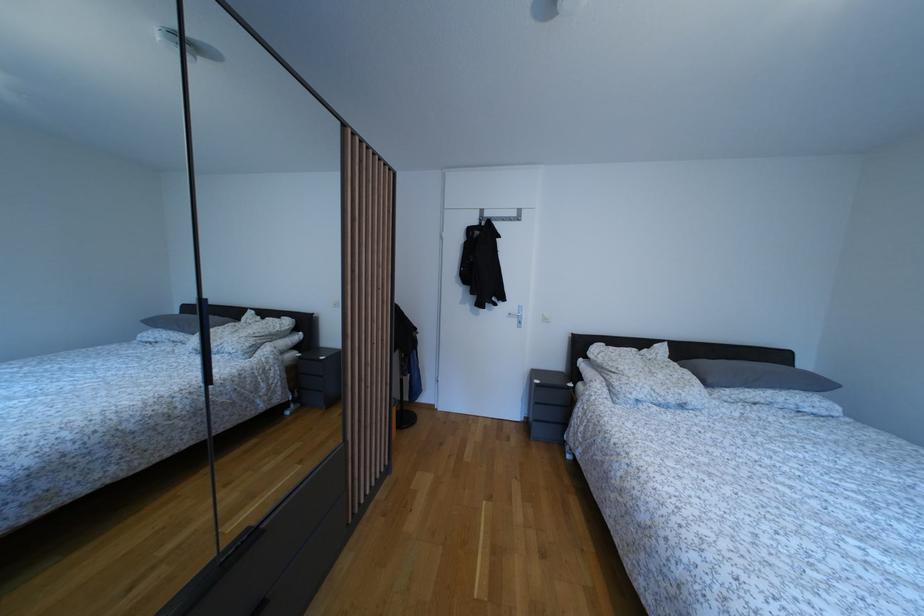
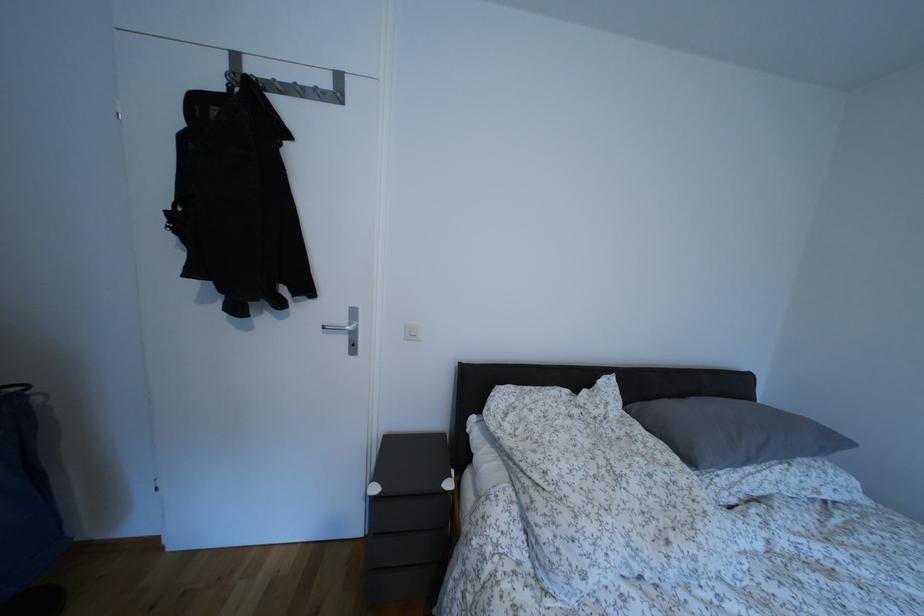
The point at (521, 317) is marked in the first image. Where is the corresponding point in the second image?

(348, 325)